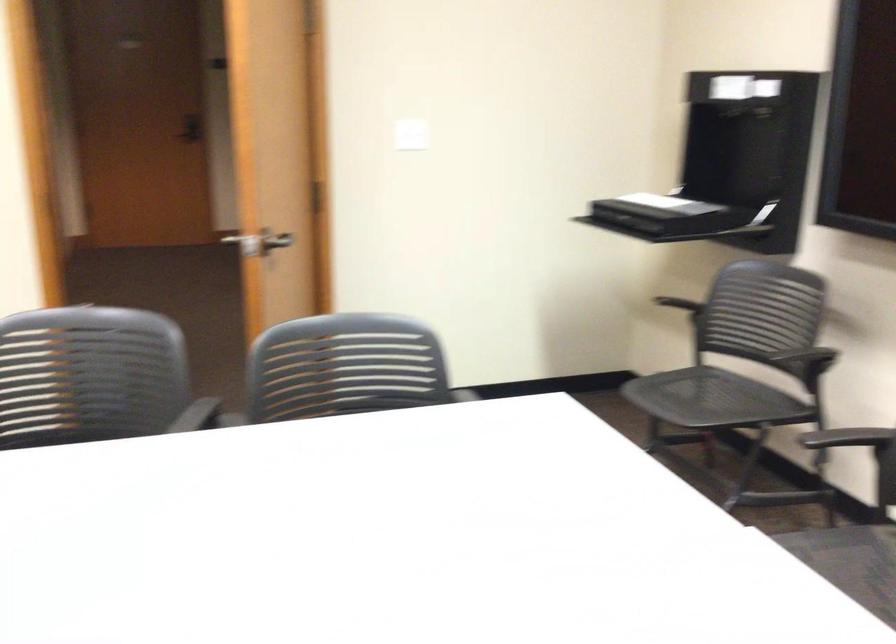
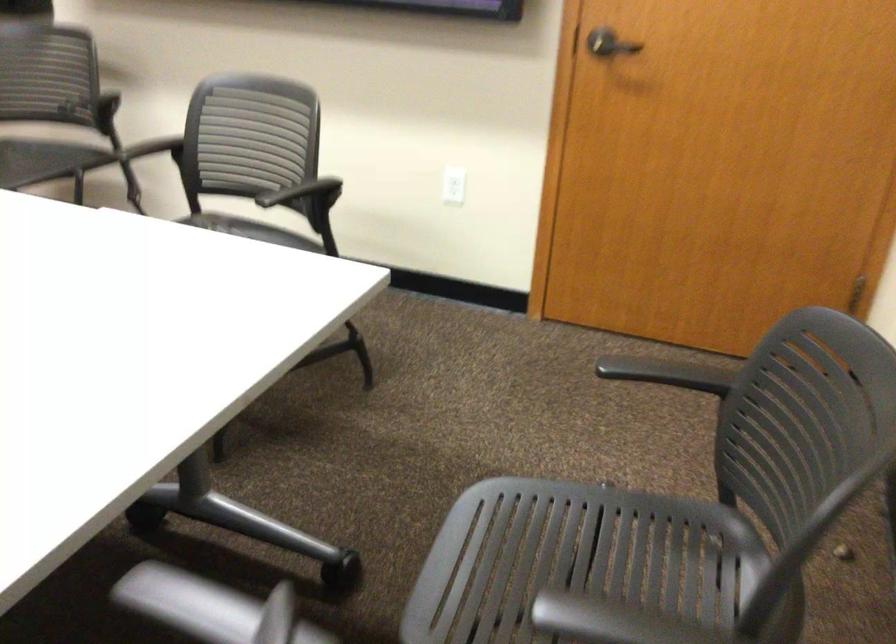
How did the camera likely rotate?

The camera rotated toward right-down.